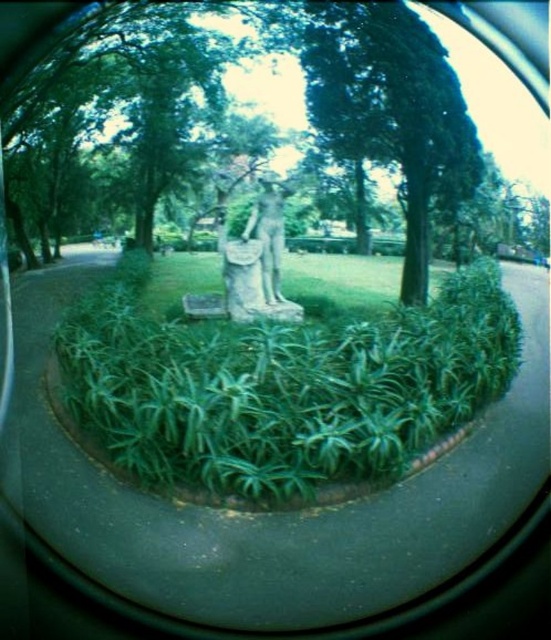
From the picture: Is green leafy grass at center closer to camera compared to green leafy tree at center?

Yes, it is in front of green leafy tree at center.

How much distance is there between green leafy grass at center and green leafy tree at center?

green leafy grass at center and green leafy tree at center are 19.83 feet apart.

Identify the location of green leafy grass at center. The width and height of the screenshot is (551, 640). (276, 385).

Consider the image. Which is more to the left, stone statue at center or smooth stone statue at center?

stone statue at center

Can you confirm if stone statue at center is shorter than smooth stone statue at center?

In fact, stone statue at center may be taller than smooth stone statue at center.

Between point (278, 250) and point (273, 202), which one is positioned behind?

The point (278, 250) is behind.

Where is `stone statue at center`? stone statue at center is located at coordinates (258, 259).

Does green leafy tree at center have a larger size compared to stone statue at center?

Actually, green leafy tree at center might be smaller than stone statue at center.

Consider the image. Does green leafy tree at center appear on the left side of stone statue at center?

In fact, green leafy tree at center is to the right of stone statue at center.

Where is `green leafy tree at center`? This screenshot has height=640, width=551. green leafy tree at center is located at coordinates (391, 109).